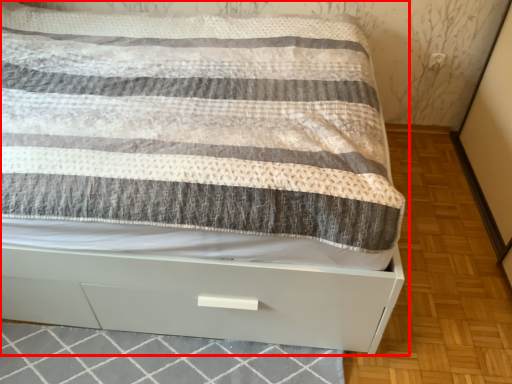
Question: From the image's perspective, where is bed (annotated by the red box) located relative to tile?

Choices:
 (A) above
 (B) below

Answer: (A)